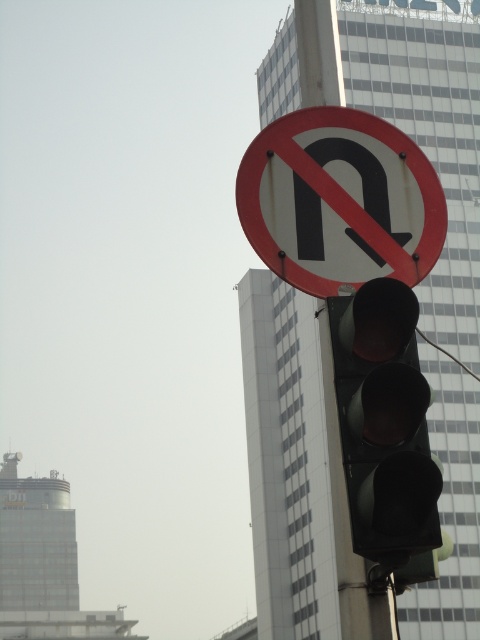
Question: Does red painted circle at upper center lie behind black matte traffic light at center?

Choices:
 (A) no
 (B) yes

Answer: (B)

Question: Which object appears closest to the camera in this image?

Choices:
 (A) black matte traffic light at center
 (B) red painted circle at upper center

Answer: (A)

Question: Does red painted circle at upper center appear under black matte traffic light at center?

Choices:
 (A) no
 (B) yes

Answer: (A)

Question: Can you confirm if red painted circle at upper center is positioned below black matte traffic light at center?

Choices:
 (A) no
 (B) yes

Answer: (A)